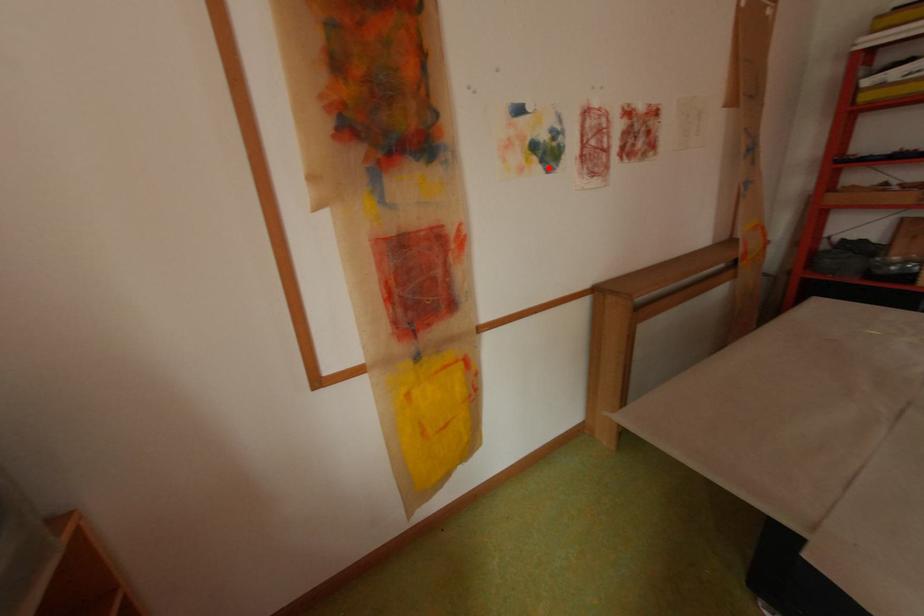
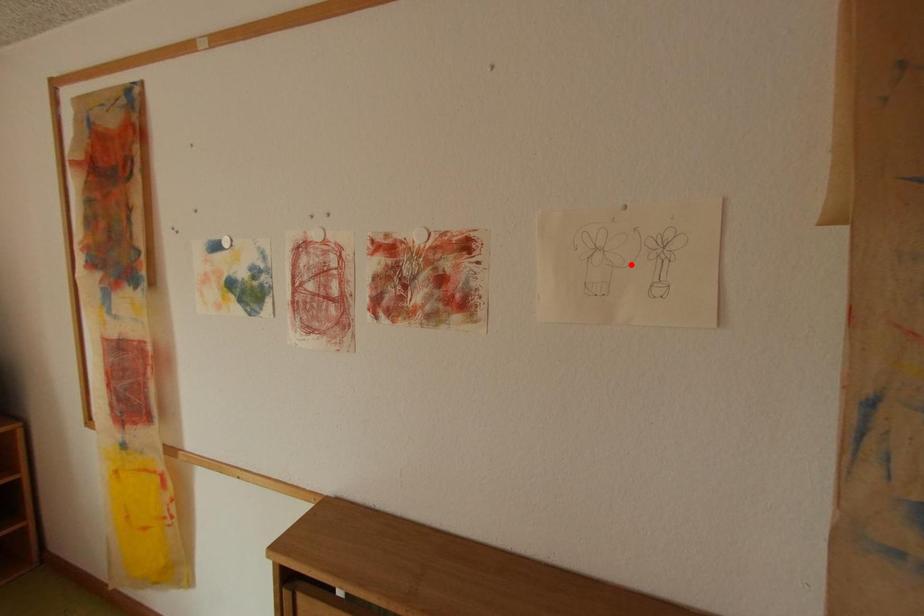
I am providing you with two images of the same scene from different viewpoints. A red point is marked on the first image and another point is marked on the second image. Is the red point in image1 aligned with the point shown in image2?

No